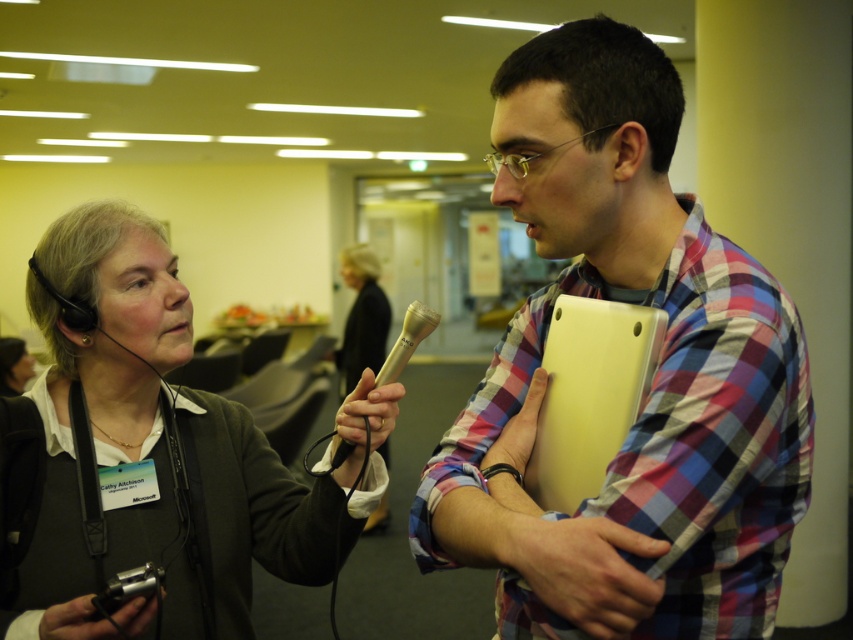
Question: From the image, what is the correct spatial relationship of matte yellow laptop at center in relation to matte black microphone at center?

Choices:
 (A) above
 (B) below

Answer: (A)

Question: Observing the image, what is the correct spatial positioning of matte yellow laptop at center in reference to matte black headset at left?

Choices:
 (A) right
 (B) left

Answer: (A)

Question: Does matte black headset at left have a larger size compared to matte black microphone at center?

Choices:
 (A) yes
 (B) no

Answer: (B)

Question: Which point is closer to the camera taking this photo?

Choices:
 (A) (361, 269)
 (B) (44, 596)

Answer: (B)

Question: Which is farther from the matte yellow laptop at center?

Choices:
 (A) matte black microphone at center
 (B) matte black headset at left

Answer: (A)

Question: Which point is closer to the camera taking this photo?

Choices:
 (A) click(747, 401)
 (B) click(357, 268)

Answer: (A)